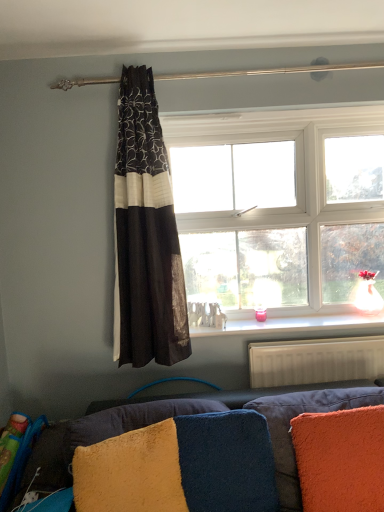
Image resolution: width=384 pixels, height=512 pixels. Identify the location of fuzzy yellow pillow at lower left, acting as the third pillow starting from the right. (130, 472).

Find the location of `orange fuzzy pillow at lower right, which is the third pillow in left-to-right order`. orange fuzzy pillow at lower right, which is the third pillow in left-to-right order is located at coordinates (340, 459).

The image size is (384, 512). Describe the element at coordinates (278, 210) in the screenshot. I see `white plastic window at center` at that location.

Image resolution: width=384 pixels, height=512 pixels. What do you see at coordinates (145, 234) in the screenshot?
I see `black sheer curtain at center` at bounding box center [145, 234].

Find the location of `fuzzy yellow pillow at lower left, acting as the third pillow starting from the right`. fuzzy yellow pillow at lower left, acting as the third pillow starting from the right is located at coordinates (130, 472).

Considering the relative sizes of fluffy blue/yellow pillow at lower center, which is counted as the second pillow, starting from the left, and black sheer curtain at center in the image provided, is fluffy blue/yellow pillow at lower center, which is counted as the second pillow, starting from the left, shorter than black sheer curtain at center?

Yes, fluffy blue/yellow pillow at lower center, which is counted as the second pillow, starting from the left, is shorter than black sheer curtain at center.

Would you say fluffy blue/yellow pillow at lower center, which is counted as the second pillow, starting from the left, is outside black sheer curtain at center?

Indeed, fluffy blue/yellow pillow at lower center, which is counted as the second pillow, starting from the left, is completely outside black sheer curtain at center.

Could you tell me if fluffy blue/yellow pillow at lower center, which is the second pillow from right to left, is turned towards black sheer curtain at center?

No.

Is fluffy blue/yellow pillow at lower center, which is counted as the second pillow, starting from the left, smaller than black sheer curtain at center?

Indeed, fluffy blue/yellow pillow at lower center, which is counted as the second pillow, starting from the left, has a smaller size compared to black sheer curtain at center.

You are a GUI agent. You are given a task and a screenshot of the screen. Output one action in this format:
    pyautogui.click(x=<x>, y=<y>)
    Task: Click on the curtain above the white textured radiator at lower right (from a real-world perspective)
    
    Given the screenshot: What is the action you would take?
    pyautogui.click(x=145, y=234)

Is black sheer curtain at center taller than white textured radiator at lower right?

Yes.

Which is in front, point (160, 206) or point (330, 373)?

The point (160, 206) is closer to the camera.

Is black sheer curtain at center bigger or smaller than white textured radiator at lower right?

Considering their sizes, black sheer curtain at center takes up more space than white textured radiator at lower right.

Does white plastic window at center come behind orange fuzzy pillow at lower right, which is the third pillow in left-to-right order?

Yes, white plastic window at center is further from the camera.

Which object is positioned more to the right, white plastic window at center or orange fuzzy pillow at lower right, positioned as the first pillow in right-to-left order?

orange fuzzy pillow at lower right, positioned as the first pillow in right-to-left order, is more to the right.

From the image's perspective, is white plastic window at center located above or below orange fuzzy pillow at lower right, which is the third pillow in left-to-right order?

Based on their image positions, white plastic window at center is located above orange fuzzy pillow at lower right, which is the third pillow in left-to-right order.

Locate an element on the screen. This screenshot has height=512, width=384. window on the right of fuzzy yellow pillow at lower left, acting as the third pillow starting from the right is located at coordinates (x=278, y=210).

Which is behind, point (163, 432) or point (251, 292)?

The point (251, 292) is farther.

Which of these two, fuzzy yellow pillow at lower left, acting as the third pillow starting from the right, or white plastic window at center, is wider?

With larger width is fuzzy yellow pillow at lower left, acting as the third pillow starting from the right.

In the scene shown: Is fuzzy yellow pillow at lower left, acting as the third pillow starting from the right, in front of or behind white plastic window at center in the image?

In the image, fuzzy yellow pillow at lower left, acting as the third pillow starting from the right, appears in front of white plastic window at center.

Is fluffy blue/yellow pillow at lower center, which is counted as the second pillow, starting from the left, far from fuzzy yellow pillow at lower left, acting as the third pillow starting from the right?

No.

Measure the distance between fluffy blue/yellow pillow at lower center, which is the second pillow from right to left, and fuzzy yellow pillow at lower left, marked as the 1th pillow in a left-to-right arrangement.

A distance of 7.75 inches exists between fluffy blue/yellow pillow at lower center, which is the second pillow from right to left, and fuzzy yellow pillow at lower left, marked as the 1th pillow in a left-to-right arrangement.

Consider the image. Is fluffy blue/yellow pillow at lower center, which is the second pillow from right to left, thinner than fuzzy yellow pillow at lower left, marked as the 1th pillow in a left-to-right arrangement?

Indeed, fluffy blue/yellow pillow at lower center, which is the second pillow from right to left, has a lesser width compared to fuzzy yellow pillow at lower left, marked as the 1th pillow in a left-to-right arrangement.

From the image's perspective, which one is positioned lower, fluffy blue/yellow pillow at lower center, which is the second pillow from right to left, or fuzzy yellow pillow at lower left, marked as the 1th pillow in a left-to-right arrangement?

fuzzy yellow pillow at lower left, marked as the 1th pillow in a left-to-right arrangement, from the image's perspective.

Consider the image. Can black sheer curtain at center be found inside white textured radiator at lower right?

Actually, black sheer curtain at center is outside white textured radiator at lower right.

From a real-world perspective, is white textured radiator at lower right above or below black sheer curtain at center?

Clearly, from a real-world perspective, white textured radiator at lower right is below black sheer curtain at center.

From the image's perspective, relative to black sheer curtain at center, is white textured radiator at lower right above or below?

Clearly, from the image's perspective, white textured radiator at lower right is below black sheer curtain at center.

In order to click on radiator behind the black sheer curtain at center in this screenshot , I will do `click(315, 361)`.

Is white plastic window at center not within white textured radiator at lower right?

That's correct, white plastic window at center is outside of white textured radiator at lower right.

Can you tell me how much white plastic window at center and white textured radiator at lower right differ in facing direction?

0.813 degrees.

Which object is closer to the camera, white plastic window at center or white textured radiator at lower right?

white textured radiator at lower right.

This screenshot has height=512, width=384. I want to click on the 1st pillow in front of the black sheer curtain at center, counting from the anchor's position, so click(226, 462).

Where is `radiator located underneath the black sheer curtain at center (from a real-world perspective)`? This screenshot has height=512, width=384. radiator located underneath the black sheer curtain at center (from a real-world perspective) is located at coordinates (315, 361).

When comparing their distances from fluffy blue/yellow pillow at lower center, which is counted as the second pillow, starting from the left, does black sheer curtain at center or white textured radiator at lower right seem further?

Based on the image, black sheer curtain at center appears to be further to fluffy blue/yellow pillow at lower center, which is counted as the second pillow, starting from the left.

Looking at the image, which one is located closer to white plastic window at center, velvet blue couch at lower center or black sheer curtain at center?

black sheer curtain at center is closer to white plastic window at center.

From the image, which object appears to be nearer to white glossy window sill at center, fluffy blue/yellow pillow at lower center, which is counted as the second pillow, starting from the left, or white textured radiator at lower right?

Among the two, white textured radiator at lower right is located nearer to white glossy window sill at center.

From the image, which object appears to be nearer to white textured radiator at lower right, black sheer curtain at center or fuzzy yellow pillow at lower left, marked as the 1th pillow in a left-to-right arrangement?

Based on the image, black sheer curtain at center appears to be nearer to white textured radiator at lower right.

Considering their positions, is white textured radiator at lower right positioned further to white glossy window sill at center than fuzzy yellow pillow at lower left, acting as the third pillow starting from the right?

fuzzy yellow pillow at lower left, acting as the third pillow starting from the right.

When comparing their distances from fluffy blue/yellow pillow at lower center, which is the second pillow from right to left, does white plastic window at center or white glossy window sill at center seem further?

white plastic window at center is further to fluffy blue/yellow pillow at lower center, which is the second pillow from right to left.

Considering their positions, is orange fuzzy pillow at lower right, positioned as the first pillow in right-to-left order, positioned closer to white textured radiator at lower right than white glossy window sill at center?

white glossy window sill at center lies closer to white textured radiator at lower right than the other object.

Based on their spatial positions, is white glossy window sill at center or white textured radiator at lower right closer to white plastic window at center?

white glossy window sill at center lies closer to white plastic window at center than the other object.

Image resolution: width=384 pixels, height=512 pixels. I want to click on window sill that lies between black sheer curtain at center and fluffy blue/yellow pillow at lower center, which is the second pillow from right to left, from top to bottom, so click(x=299, y=325).

Locate an element on the screen. The height and width of the screenshot is (512, 384). curtain between white plastic window at center and orange fuzzy pillow at lower right, which is the third pillow in left-to-right order, vertically is located at coordinates (145, 234).

The height and width of the screenshot is (512, 384). I want to click on window sill between white plastic window at center and fuzzy yellow pillow at lower left, acting as the third pillow starting from the right, vertically, so point(299,325).

Where is `window sill between fuzzy yellow pillow at lower left, acting as the third pillow starting from the right, and white textured radiator at lower right, in the horizontal direction`? Image resolution: width=384 pixels, height=512 pixels. window sill between fuzzy yellow pillow at lower left, acting as the third pillow starting from the right, and white textured radiator at lower right, in the horizontal direction is located at coordinates (299, 325).